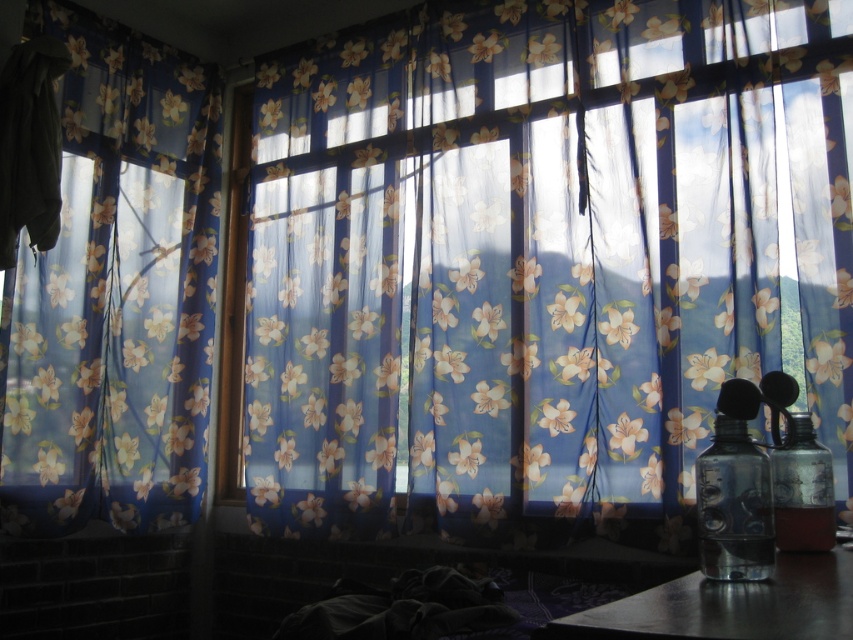
Which is in front, point (827, 445) or point (730, 616)?

Positioned in front is point (730, 616).

Consider the image. Who is more distant from viewer, [294,330] or [543,628]?

The point [294,330] is more distant.

Is point (659, 284) farther from viewer compared to point (840, 637)?

Yes, point (659, 284) is behind point (840, 637).

The width and height of the screenshot is (853, 640). Identify the location of floral sheer curtains at center. (538, 257).

Does point (737, 630) lie in front of point (766, 508)?

Yes, point (737, 630) is in front of point (766, 508).

What are the coordinates of `metallic dark gray table at lower right` in the screenshot? It's located at (729, 605).

Between point (741, 605) and point (769, 544), which one is positioned behind?

The point (769, 544) is more distant.

Locate an element on the screen. Image resolution: width=853 pixels, height=640 pixels. metallic dark gray table at lower right is located at coordinates (729, 605).

Is floral sheer curtains at center to the right of translucent plastic bottle at right from the viewer's perspective?

No, floral sheer curtains at center is not to the right of translucent plastic bottle at right.

Which is in front, point (515, 122) or point (814, 490)?

Positioned in front is point (814, 490).

You are a GUI agent. You are given a task and a screenshot of the screen. Output one action in this format:
    pyautogui.click(x=<x>, y=<y>)
    Task: Click on the floral sheer curtains at center
    The width and height of the screenshot is (853, 640).
    Given the screenshot: What is the action you would take?
    pyautogui.click(x=538, y=257)